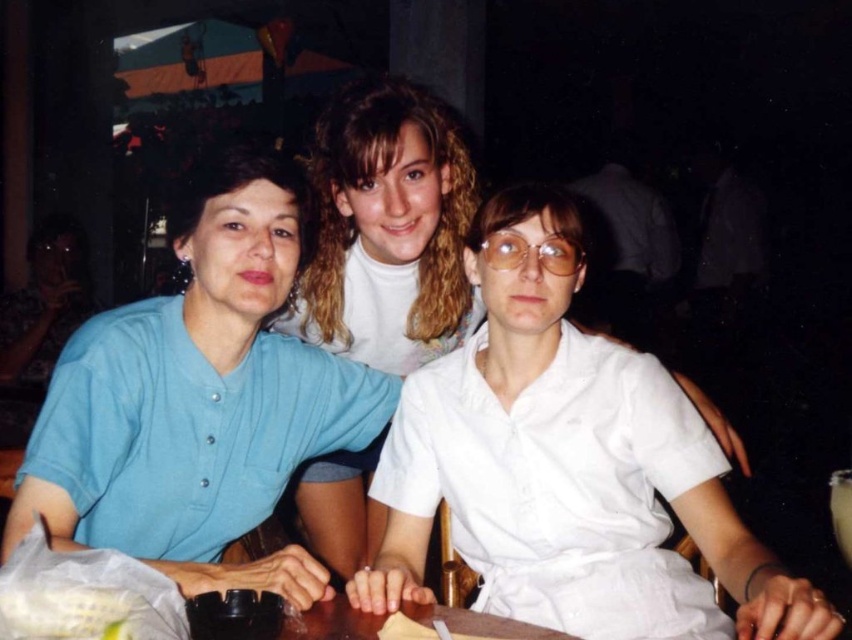
Question: Can you confirm if matte blue shirt at left is positioned to the left of white matte shirt at center?

Choices:
 (A) no
 (B) yes

Answer: (B)

Question: Among these points, which one is farthest from the camera?

Choices:
 (A) (61, 435)
 (B) (332, 163)

Answer: (B)

Question: Is matte blue shirt at left further to camera compared to white matte shirt at center?

Choices:
 (A) no
 (B) yes

Answer: (A)

Question: Can you confirm if matte blue shirt at left is positioned to the left of white matte shirt at center?

Choices:
 (A) no
 (B) yes

Answer: (B)